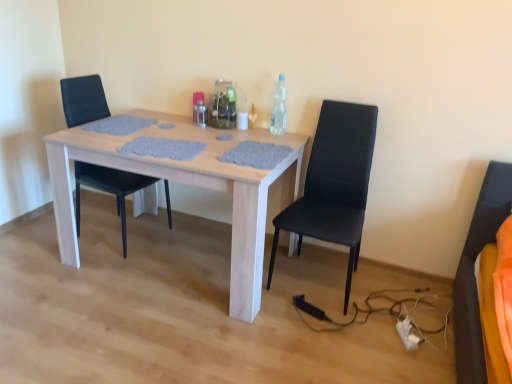
Find the location of a particular element. This screenshot has height=384, width=512. clear plastic bottle at upper right, arranged as the third bottle when viewed from the left is located at coordinates (279, 108).

The height and width of the screenshot is (384, 512). Describe the element at coordinates (279, 108) in the screenshot. I see `clear plastic bottle at upper right, arranged as the third bottle when viewed from the left` at that location.

Locate an element on the screen. white fabric extension cord at lower right is located at coordinates (407, 334).

You are a GUI agent. You are given a task and a screenshot of the screen. Output one action in this format:
    pyautogui.click(x=<x>, y=<y>)
    Task: Click on the black leather chair at center, marked as the second chair in a right-to-left arrangement
    
    Given the screenshot: What is the action you would take?
    pyautogui.click(x=110, y=188)

Image resolution: width=512 pixels, height=384 pixels. Describe the element at coordinates (110, 188) in the screenshot. I see `black leather chair at center, the 1th chair viewed from the left` at that location.

The image size is (512, 384). Describe the element at coordinates (334, 183) in the screenshot. I see `black leather chair at right, arranged as the second chair when viewed from the left` at that location.

Find the location of `metallic silver bottle at center, arranged as the first bottle when viewed from the left`. metallic silver bottle at center, arranged as the first bottle when viewed from the left is located at coordinates (200, 113).

From the image's perspective, starting from the clear plastic bottle at upper right, arranged as the third bottle when viewed from the left, which chair is the 2nd one below? Please provide its 2D coordinates.

[(334, 183)]

Is black leather chair at right, which is counted as the 1th chair, starting from the right, oriented towards clear plastic bottle at upper right, arranged as the third bottle when viewed from the left?

No, black leather chair at right, which is counted as the 1th chair, starting from the right, is not facing towards clear plastic bottle at upper right, arranged as the third bottle when viewed from the left.

From the image's perspective, is black leather chair at right, arranged as the second chair when viewed from the left, above clear plastic bottle at upper right, placed as the 1th bottle when sorted from right to left?

No, from the image's perspective, black leather chair at right, arranged as the second chair when viewed from the left, is not above clear plastic bottle at upper right, placed as the 1th bottle when sorted from right to left.

Which is closer, [344,176] or [286,111]?

Positioned in front is point [344,176].

Image resolution: width=512 pixels, height=384 pixels. I want to click on the 3rd bottle above the black leather chair at right, which is counted as the 1th chair, starting from the right (from the image's perspective), so click(x=223, y=105).

Is clear glass bottle at center, the 2th bottle from the left, to the right of black leather chair at right, which is counted as the 1th chair, starting from the right, from the viewer's perspective?

Incorrect, clear glass bottle at center, the 2th bottle from the left, is not on the right side of black leather chair at right, which is counted as the 1th chair, starting from the right.

In the scene shown: Is clear glass bottle at center, the 2th bottle from the left, thinner than black leather chair at right, which is counted as the 1th chair, starting from the right?

Yes, clear glass bottle at center, the 2th bottle from the left, is thinner than black leather chair at right, which is counted as the 1th chair, starting from the right.

How different are the orientations of clear glass bottle at center, the second bottle positioned from the right, and black leather chair at right, which is counted as the 1th chair, starting from the right, in degrees?

The angle between the facing direction of clear glass bottle at center, the second bottle positioned from the right, and the facing direction of black leather chair at right, which is counted as the 1th chair, starting from the right, is 4.66 degrees.

Considering the relative sizes of clear plastic bottle at upper right, arranged as the third bottle when viewed from the left, and light wood table at center in the image provided, is clear plastic bottle at upper right, arranged as the third bottle when viewed from the left, smaller than light wood table at center?

Correct, clear plastic bottle at upper right, arranged as the third bottle when viewed from the left, occupies less space than light wood table at center.

From a real-world perspective, is clear plastic bottle at upper right, arranged as the third bottle when viewed from the left, on light wood table at center?

Yes, from a real-world perspective, clear plastic bottle at upper right, arranged as the third bottle when viewed from the left, is over light wood table at center

Which is in front, point (284, 86) or point (202, 160)?

The point (202, 160) is closer to the camera.

Who is bigger, metallic silver bottle at center, arranged as the first bottle when viewed from the left, or light wood table at center?

light wood table at center is bigger.

How far apart are metallic silver bottle at center, which is counted as the 3th bottle, starting from the right, and light wood table at center?

23.28 inches.

Which is more to the left, metallic silver bottle at center, arranged as the first bottle when viewed from the left, or light wood table at center?

light wood table at center is more to the left.

Which is behind, light wood table at center or clear plastic bottle at upper right, placed as the 1th bottle when sorted from right to left?

clear plastic bottle at upper right, placed as the 1th bottle when sorted from right to left, is further from the camera.

Considering the points (68, 170) and (272, 128), which point is in front, point (68, 170) or point (272, 128)?

The point (68, 170) is more forward.

Is light wood table at center turned away from clear plastic bottle at upper right, arranged as the third bottle when viewed from the left?

No, light wood table at center is not facing the opposite direction of clear plastic bottle at upper right, arranged as the third bottle when viewed from the left.

Is light wood table at center touching clear plastic bottle at upper right, placed as the 1th bottle when sorted from right to left?

No, light wood table at center is not in contact with clear plastic bottle at upper right, placed as the 1th bottle when sorted from right to left.

Consider the image. Does light wood table at center have a larger size compared to black leather chair at right, which is counted as the 1th chair, starting from the right?

Yes, light wood table at center is bigger than black leather chair at right, which is counted as the 1th chair, starting from the right.

Does light wood table at center appear on the right side of black leather chair at right, which is counted as the 1th chair, starting from the right?

No.

Is light wood table at center positioned far away from black leather chair at right, arranged as the second chair when viewed from the left?

No, there isn't a large distance between light wood table at center and black leather chair at right, arranged as the second chair when viewed from the left.

How many degrees apart are the facing directions of black leather chair at right, which is counted as the 1th chair, starting from the right, and clear glass bottle at center, the 2th bottle from the left?

The facing directions of black leather chair at right, which is counted as the 1th chair, starting from the right, and clear glass bottle at center, the 2th bottle from the left, are 4.66 degrees apart.

From the clear glass bottle at center, the 2th bottle from the left, count 2nd chairs forward and point to it. Please provide its 2D coordinates.

[(334, 183)]

From a real-world perspective, is black leather chair at right, which is counted as the 1th chair, starting from the right, below clear glass bottle at center, the second bottle positioned from the right?

Yes, from a real-world perspective, black leather chair at right, which is counted as the 1th chair, starting from the right, is under clear glass bottle at center, the second bottle positioned from the right.

Between black leather chair at right, which is counted as the 1th chair, starting from the right, and clear glass bottle at center, the second bottle positioned from the right, which one has smaller width?

Answer: With smaller width is clear glass bottle at center, the second bottle positioned from the right.

The height and width of the screenshot is (384, 512). I want to click on the 1st bottle to the left of the black leather chair at right, arranged as the second chair when viewed from the left, counting from the anchor's position, so click(279, 108).

This screenshot has width=512, height=384. Find the location of `the 2nd chair in front of the clear glass bottle at center, the second bottle positioned from the right, starting your count from the anchor`. the 2nd chair in front of the clear glass bottle at center, the second bottle positioned from the right, starting your count from the anchor is located at coordinates coord(334,183).

When comparing their distances from metallic silver bottle at center, arranged as the first bottle when viewed from the left, does black leather chair at right, which is counted as the 1th chair, starting from the right, or black leather chair at center, the 1th chair viewed from the left, seem closer?

black leather chair at center, the 1th chair viewed from the left.

When comparing their distances from metallic silver bottle at center, which is counted as the 3th bottle, starting from the right, does white fabric extension cord at lower right or clear plastic bottle at upper right, arranged as the third bottle when viewed from the left, seem further?

The object further to metallic silver bottle at center, which is counted as the 3th bottle, starting from the right, is white fabric extension cord at lower right.

In the scene shown: Estimate the real-world distances between objects in this image. Which object is further from white fabric extension cord at lower right, black leather chair at right, arranged as the second chair when viewed from the left, or light wood table at center?

Based on the image, light wood table at center appears to be further to white fabric extension cord at lower right.

Considering their positions, is metallic silver bottle at center, arranged as the first bottle when viewed from the left, positioned closer to clear glass bottle at center, the second bottle positioned from the right, than black leather chair at right, which is counted as the 1th chair, starting from the right?

metallic silver bottle at center, arranged as the first bottle when viewed from the left, lies closer to clear glass bottle at center, the second bottle positioned from the right, than the other object.

Considering their positions, is metallic silver bottle at center, arranged as the first bottle when viewed from the left, positioned further to light wood table at center than black leather chair at right, which is counted as the 1th chair, starting from the right?

metallic silver bottle at center, arranged as the first bottle when viewed from the left, lies further to light wood table at center than the other object.

Based on their spatial positions, is light wood table at center or white fabric extension cord at lower right closer to clear glass bottle at center, the 2th bottle from the left?

light wood table at center.

From the image, which object appears to be farther from metallic silver bottle at center, arranged as the first bottle when viewed from the left, black leather chair at right, which is counted as the 1th chair, starting from the right, or white fabric extension cord at lower right?

white fabric extension cord at lower right lies further to metallic silver bottle at center, arranged as the first bottle when viewed from the left, than the other object.

Estimate the real-world distances between objects in this image. Which object is further from black leather chair at center, the 1th chair viewed from the left, clear glass bottle at center, the 2th bottle from the left, or black leather chair at right, arranged as the second chair when viewed from the left?

black leather chair at right, arranged as the second chair when viewed from the left, is positioned further to the anchor black leather chair at center, the 1th chair viewed from the left.

In order to click on kitchen & dining room table between black leather chair at center, the 1th chair viewed from the left, and clear plastic bottle at upper right, placed as the 1th bottle when sorted from right to left, in the horizontal direction in this screenshot , I will do `click(189, 184)`.

Where is `bottle located between black leather chair at right, which is counted as the 1th chair, starting from the right, and clear glass bottle at center, the 2th bottle from the left, in the depth direction`? bottle located between black leather chair at right, which is counted as the 1th chair, starting from the right, and clear glass bottle at center, the 2th bottle from the left, in the depth direction is located at coordinates (279, 108).

You are a GUI agent. You are given a task and a screenshot of the screen. Output one action in this format:
    pyautogui.click(x=<x>, y=<y>)
    Task: Click on the kitchen & dining room table located between black leather chair at center, marked as the second chair in a right-to-left arrangement, and black leather chair at right, which is counted as the 1th chair, starting from the right, in the left-right direction
    
    Given the screenshot: What is the action you would take?
    pyautogui.click(x=189, y=184)

Image resolution: width=512 pixels, height=384 pixels. In order to click on kitchen & dining room table situated between black leather chair at center, marked as the second chair in a right-to-left arrangement, and white fabric extension cord at lower right from left to right in this screenshot , I will do `click(189, 184)`.